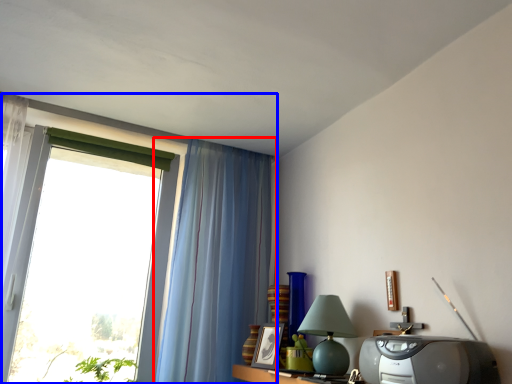
Question: Among these objects, which one is nearest to the camera, curtain (highlighted by a red box) or window (highlighted by a blue box)?

Choices:
 (A) curtain
 (B) window

Answer: (B)